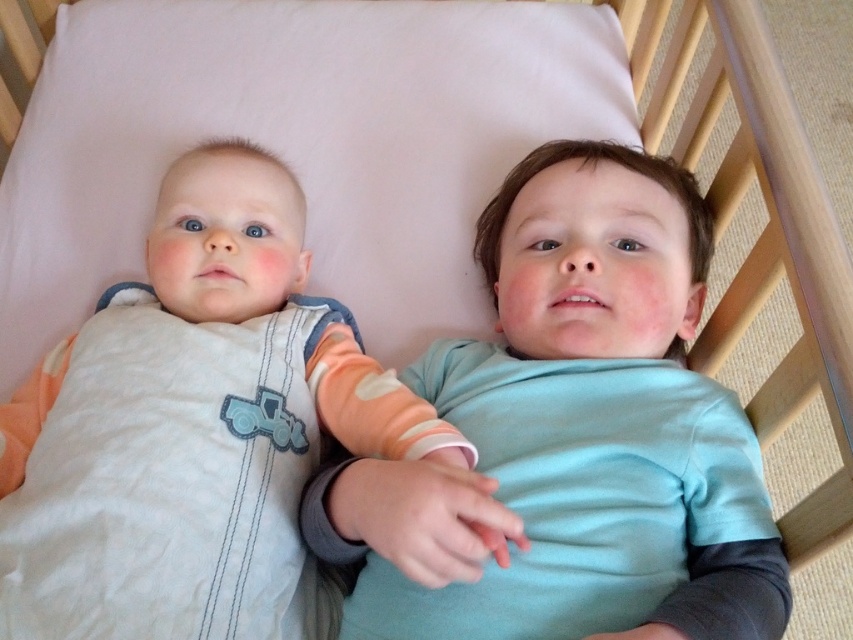
Question: Is the position of matte blue shirt at center more distant than that of white cotton onesie at center?

Choices:
 (A) yes
 (B) no

Answer: (B)

Question: Which point appears closest to the camera in this image?

Choices:
 (A) (67, 477)
 (B) (372, 620)

Answer: (A)

Question: Is matte blue shirt at center in front of white cotton onesie at center?

Choices:
 (A) no
 (B) yes

Answer: (B)

Question: Does matte blue shirt at center have a smaller size compared to white cotton onesie at center?

Choices:
 (A) yes
 (B) no

Answer: (B)